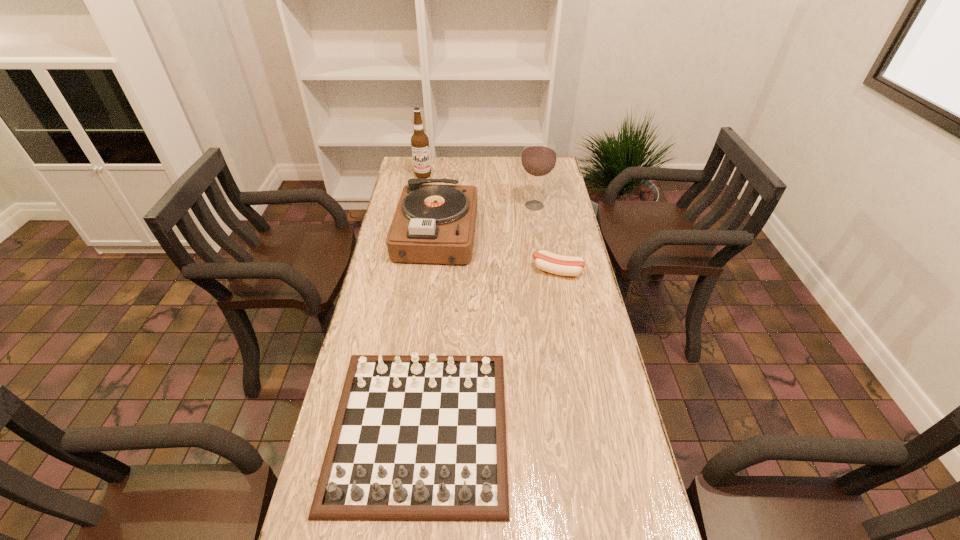
This screenshot has width=960, height=540. Find the location of `free spot between the farther alcohol and the right alcohol`. free spot between the farther alcohol and the right alcohol is located at coordinates (479, 191).

The width and height of the screenshot is (960, 540). Identify the location of empty space between the right alcohol and the chessboard. (477, 316).

Choose which object is the fourth nearest neighbor to the nearer alcohol. Please provide its 2D coordinates. Your answer should be formatted as a tuple, i.e. [(x, y)], where the tuple contains the x and y coordinates of a point satisfying the conditions above.

[(416, 437)]

The width and height of the screenshot is (960, 540). In order to click on object that is the fourth closest to the shortest object in this screenshot , I will do `click(419, 141)`.

Where is `vacant space that satisfies the following two spatial constraints: 1. on the label of the farther alcohol; 2. on the right side of the nearer alcohol`? The height and width of the screenshot is (540, 960). vacant space that satisfies the following two spatial constraints: 1. on the label of the farther alcohol; 2. on the right side of the nearer alcohol is located at coordinates (418, 205).

Identify the location of free space that satisfies the following two spatial constraints: 1. on the front side of the shortest object; 2. on the right side of the nearer alcohol. The width and height of the screenshot is (960, 540). (545, 271).